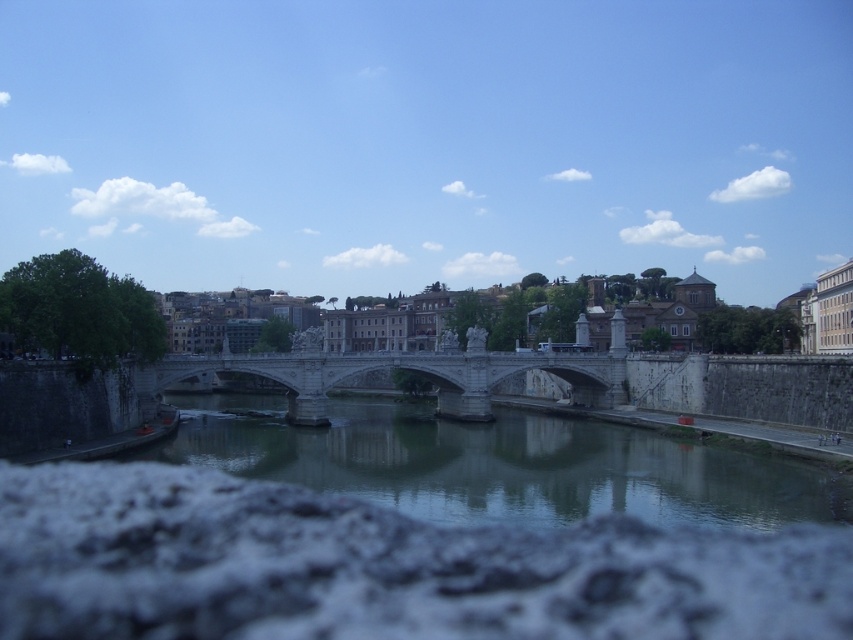
You are a delivery drone with a wingspan of 1.5 meters. You need to fly from the smooth concrete river at center to the stone bridge at center. Can you safely pass between them without touching either?

The smooth concrete river at center and stone bridge at center are 18.60 meters apart. Since your wingspan is only 1.5 meters, there is ample space for you to safely pass between them without any issues.

You are a city planner evaluating the space between the smooth concrete river at center and the stone bridge at center for a new pedestrian walkway. Can you confirm if the river is shorter than the bridge in length?

The smooth concrete river at center is shorter than the stone bridge at center, so the river is indeed shorter in length than the bridge, making it feasible to plan the walkway accordingly.